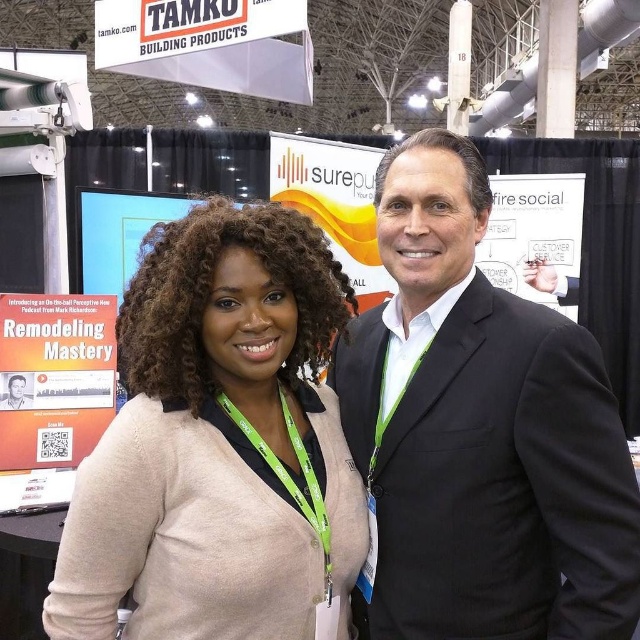
You are at a convention and need to approach the two people in the image. The man in the black suit at center is your target. Based on their positions, which direction should you move towards relative to the beige cardigan at center?

The black suit at center is to the right of the beige cardigan at center, so you should move towards the right side of the beige cardigan at center to reach the black suit at center.

You are an event organizer and need to ensure there is enough space between two attendees for a photo. The minimum required distance is 12 inches. Given the black suit at center and beige cardigan at center, do they meet the distance requirement?

The black suit at center and beige cardigan at center are 13.88 inches apart from each other, which exceeds the minimum required distance of 12 inches. Therefore, they meet the distance requirement.